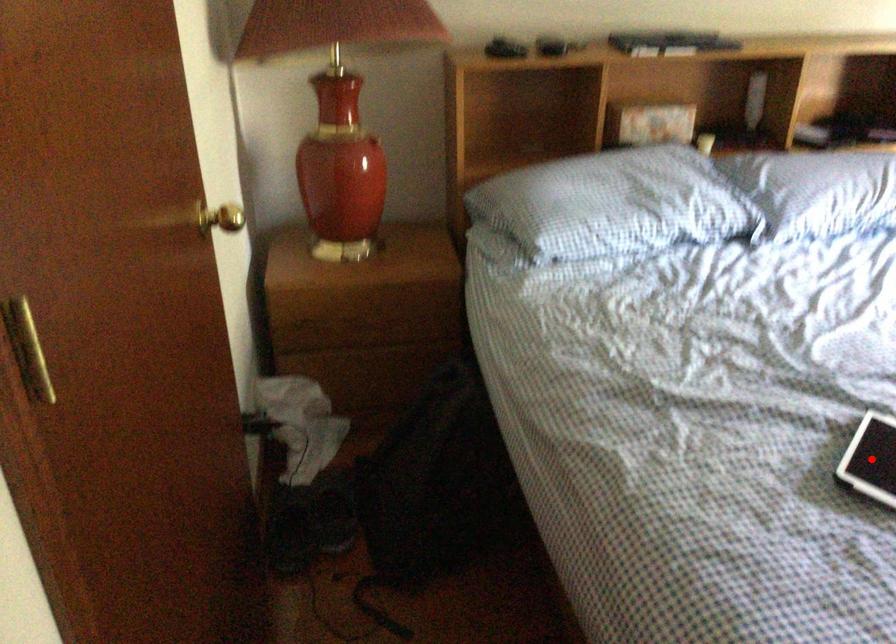
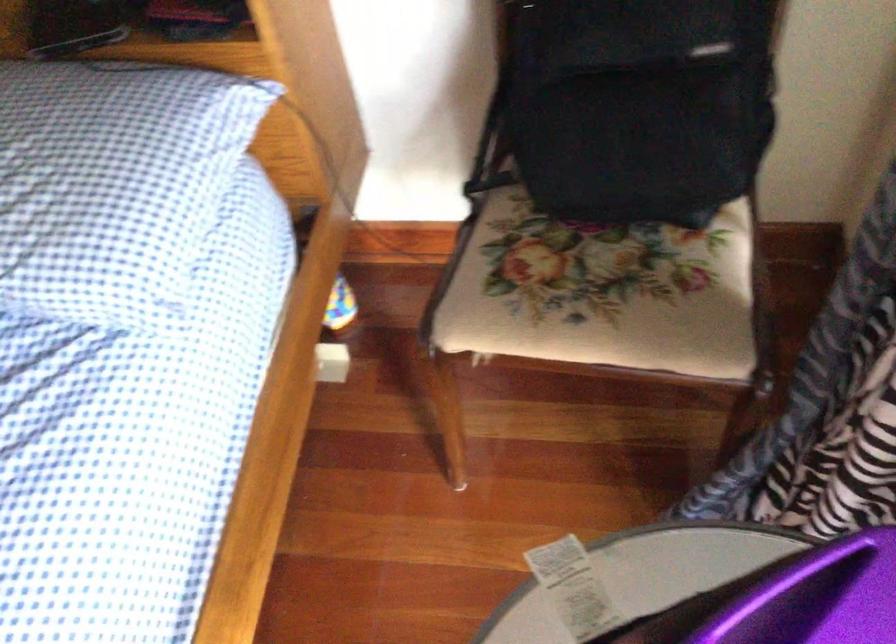
Question: I am providing you with two images of the same scene from different viewpoints. A red point is marked on the first image. Is the red point's position out of view in image 2?

Choices:
 (A) Yes
 (B) No

Answer: (A)